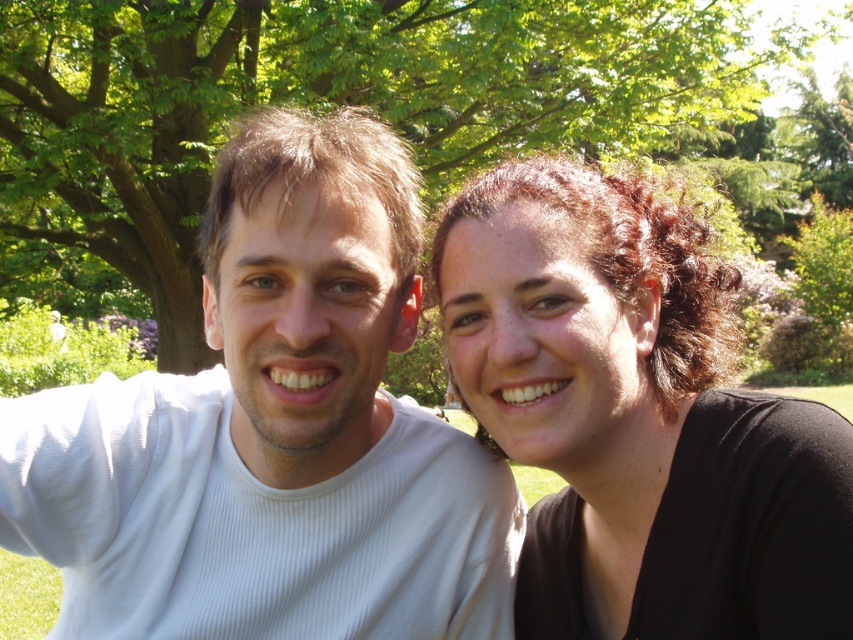
Does white ribbed shirt at left have a smaller size compared to green leafy tree at upper center?

Indeed, white ribbed shirt at left has a smaller size compared to green leafy tree at upper center.

Between white ribbed shirt at left and green leafy tree at upper center, which one is positioned lower?

white ribbed shirt at left

Describe the element at coordinates (273, 432) in the screenshot. The width and height of the screenshot is (853, 640). I see `white ribbed shirt at left` at that location.

Find the location of `white ribbed shirt at left`. white ribbed shirt at left is located at coordinates (273, 432).

Does point (320, 364) lie in front of point (462, 284)?

Yes, it is.

Who is taller, white ribbed shirt at left or matte black hair at right?

white ribbed shirt at left is taller.

Locate an element on the screen. white ribbed shirt at left is located at coordinates (273, 432).

Between matte black hair at right and green leafy tree at upper center, which one has more height?

With more height is green leafy tree at upper center.

This screenshot has height=640, width=853. What are the coordinates of `matte black hair at right` in the screenshot? It's located at (637, 419).

Between point (666, 269) and point (15, 216), which one is positioned in front?

Positioned in front is point (666, 269).

Locate an element on the screen. Image resolution: width=853 pixels, height=640 pixels. matte black hair at right is located at coordinates (637, 419).